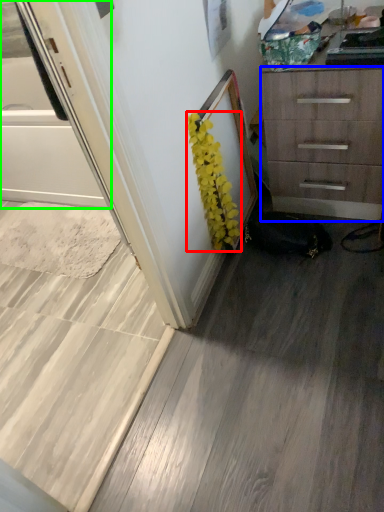
Question: Which object is the farthest from flower (highlighted by a red box)? Choose among these: chest of drawers (highlighted by a blue box) or screen door (highlighted by a green box).

Choices:
 (A) chest of drawers
 (B) screen door

Answer: (B)